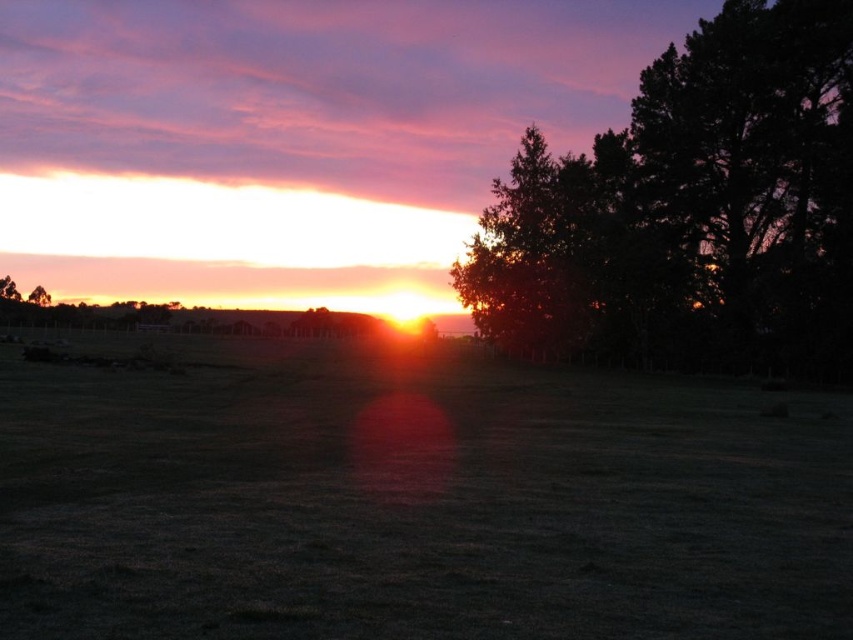
You are standing on the edge of the brown grassy field at center and want to walk to the dark green leafy tree at right. Which direction should you head towards?

You should head towards the right direction to reach the dark green leafy tree at right from the brown grassy field at center.

You are a photographer setting up your tripod in the middle of the brown grassy field at center. You want to capture the sunset without any obstructions. Is the green matte tree at left tall enough to block your view of the sunset?

The brown grassy field at center is shorter than the green matte tree at left, so the tree is taller and may block your view of the sunset.